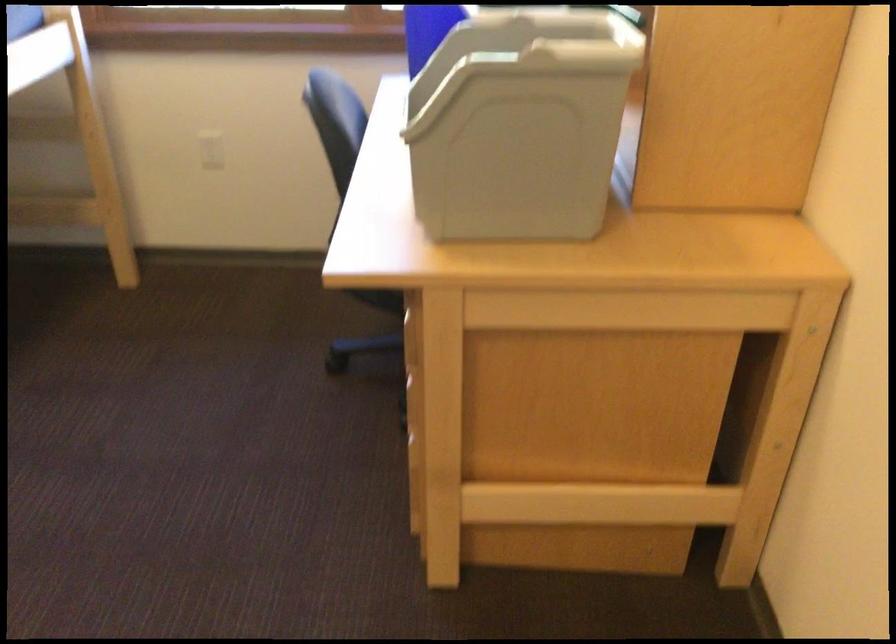
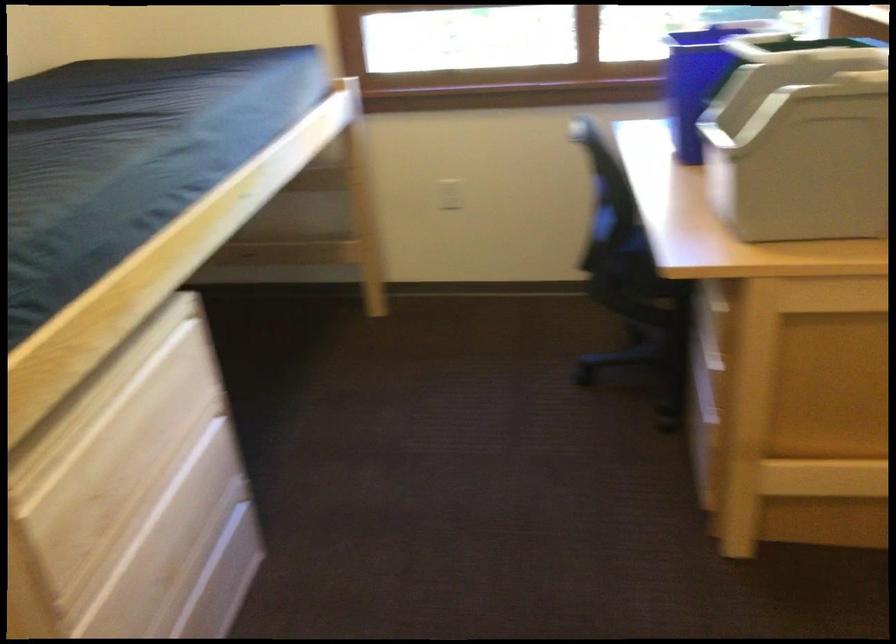
Question: How did the camera likely rotate?

Choices:
 (A) Left
 (B) Right
 (C) Up
 (D) Down

Answer: (A)